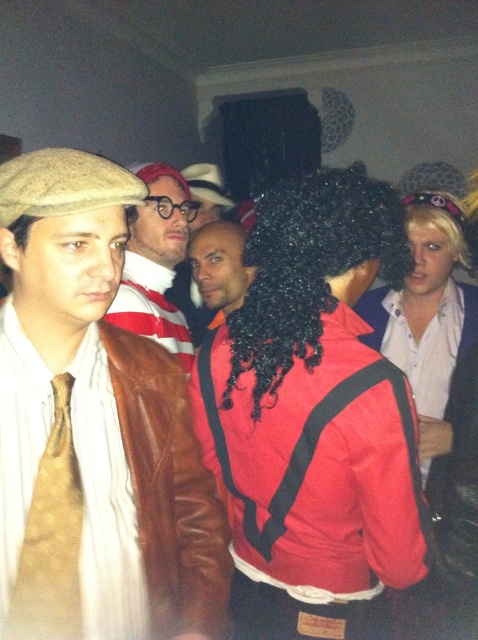
You are a photographer at the event and need to decide which wig to adjust for a closeup shot. Since both shiny black wig at center and satin black wig at center are in the frame, which one requires more space due to its width?

The shiny black wig at center requires more space because its width surpasses that of the satin black wig at center.

You are a photographer at the party and want to take a closeup of the shiny black wig at center without including the matte white shirt at center in the frame. Is this possible based on their positions?

The shiny black wig at center is closer to the viewer than the matte white shirt at center, so yes, you can take a closeup of the shiny black wig at center without including the matte white shirt at center by focusing on the foreground object.